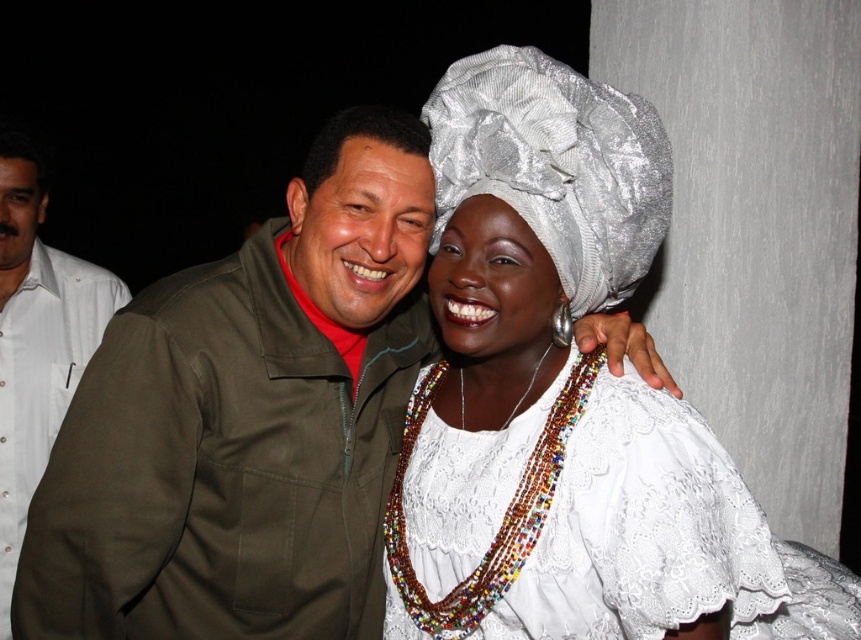
Question: Considering the real-world distances, which object is closest to the white satin turban at upper center?

Choices:
 (A) white matte head at left
 (B) multicolored beaded necklace at center
 (C) matte olive-green jacket at center

Answer: (B)

Question: Does matte olive-green jacket at center have a larger size compared to olive-green fabric jacket at center?

Choices:
 (A) yes
 (B) no

Answer: (A)

Question: Which of these objects is positioned farthest from the matte olive-green jacket at center?

Choices:
 (A) white satin turban at upper center
 (B) olive-green fabric jacket at center

Answer: (A)

Question: Does white shirt at left appear on the left side of olive-green fabric jacket at center?

Choices:
 (A) yes
 (B) no

Answer: (A)

Question: Can you confirm if white satin turban at upper center is positioned to the right of white shirt at left?

Choices:
 (A) yes
 (B) no

Answer: (A)

Question: Which point is closer to the camera?

Choices:
 (A) multicolored beaded necklace at center
 (B) olive-green fabric jacket at center

Answer: (A)